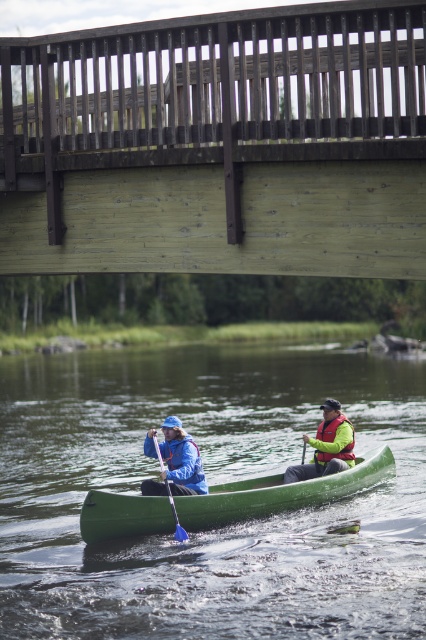
Question: Observing the image, what is the correct spatial positioning of green plastic canoe at center in reference to translucent blue paddle at center?

Choices:
 (A) right
 (B) left

Answer: (B)

Question: Observing the image, what is the correct spatial positioning of green plastic canoe at center in reference to yellow matte life jacket at center?

Choices:
 (A) below
 (B) above

Answer: (A)

Question: Can you confirm if wooden bridge at upper center is positioned to the right of green matte canoe at center?

Choices:
 (A) yes
 (B) no

Answer: (B)

Question: Among these objects, which one is nearest to the camera?

Choices:
 (A) green matte canoe at center
 (B) blue matte jacket at center
 (C) yellow matte life jacket at center

Answer: (A)

Question: Which object is the farthest from the yellow matte life jacket at center?

Choices:
 (A) wooden bridge at upper center
 (B) green matte canoe at center

Answer: (A)

Question: Which of the following is the farthest from the observer?

Choices:
 (A) yellow matte life jacket at center
 (B) blue matte jacket at center
 (C) green matte canoe at center
 (D) wooden bridge at upper center

Answer: (A)